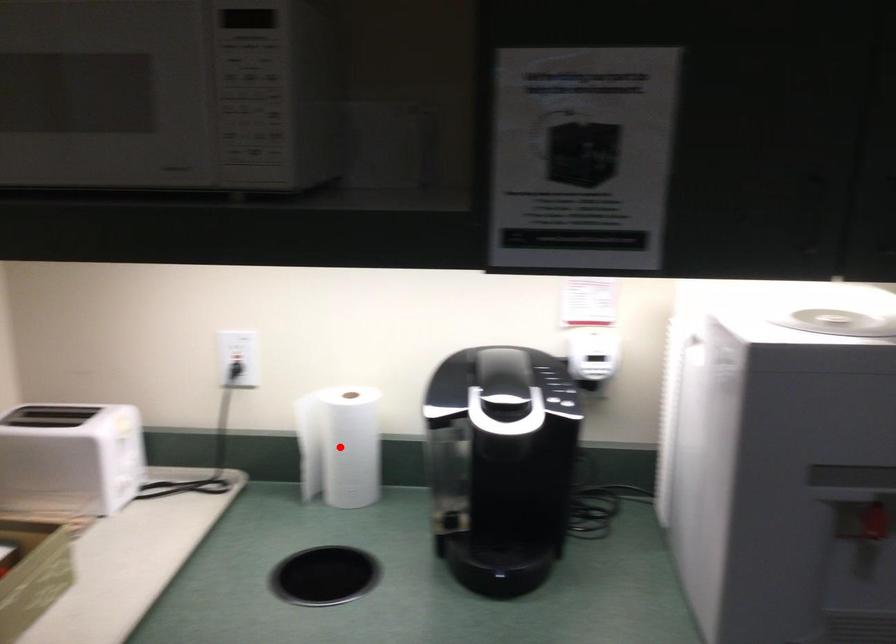
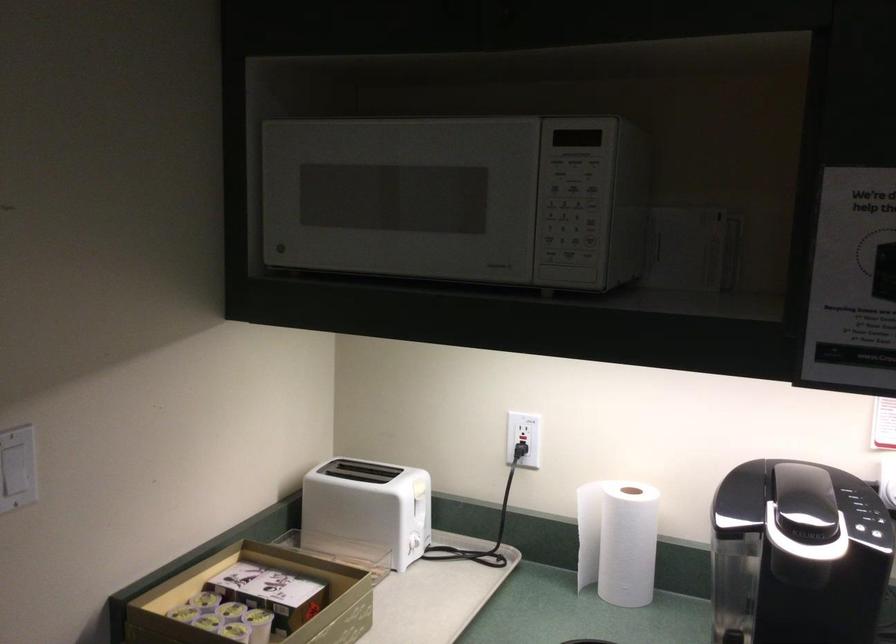
Where in the second image is the point corresponding to the highlighted location from the first image?

(617, 540)